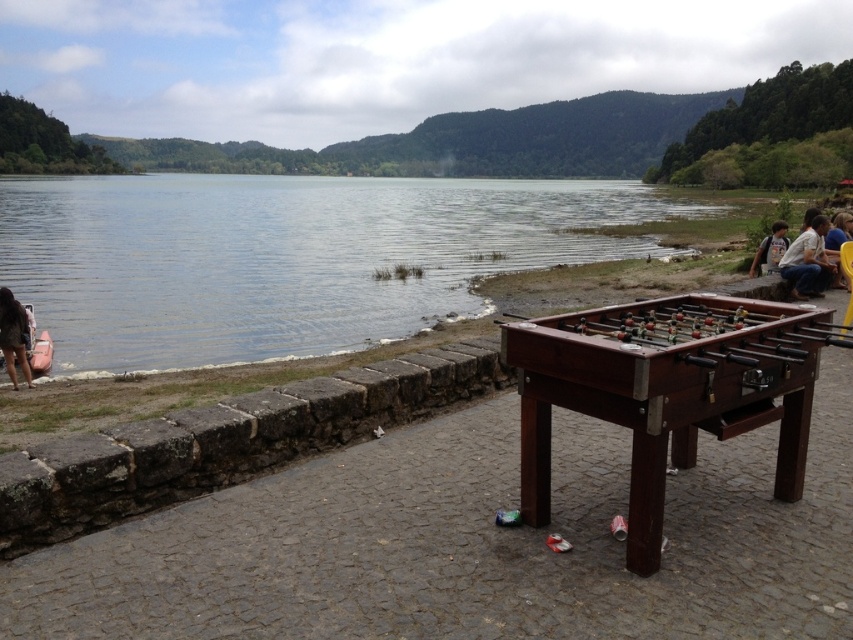
Is clear water at lake left in front of light blue denim jacket at lower right?

No.

Is the position of clear water at lake left more distant than that of light blue denim jacket at lower right?

Yes, clear water at lake left is behind light blue denim jacket at lower right.

Locate an element on the screen. This screenshot has width=853, height=640. clear water at lake left is located at coordinates (283, 257).

Where is `dark brown leather jacket at lower left`? The height and width of the screenshot is (640, 853). dark brown leather jacket at lower left is located at coordinates (13, 336).

Can you confirm if dark brown leather jacket at lower left is positioned below yellow plastic chair at right?

Correct, dark brown leather jacket at lower left is located below yellow plastic chair at right.

At what (x,y) coordinates should I click in order to perform the action: click on dark brown leather jacket at lower left. Please return your answer as a coordinate pair (x, y). The image size is (853, 640). Looking at the image, I should click on (13, 336).

Based on the photo, which of these two, wooden foosball table at center or light blue denim jacket at lower right, stands shorter?

light blue denim jacket at lower right is shorter.

Looking at this image, which is more to the right, wooden foosball table at center or light blue denim jacket at lower right?

light blue denim jacket at lower right

Is point (790, 426) in front of point (772, 248)?

Yes, point (790, 426) is closer to viewer.

You are a GUI agent. You are given a task and a screenshot of the screen. Output one action in this format:
    pyautogui.click(x=<x>, y=<y>)
    Task: Click on the wooden foosball table at center
    The image size is (853, 640).
    Given the screenshot: What is the action you would take?
    pyautogui.click(x=666, y=390)